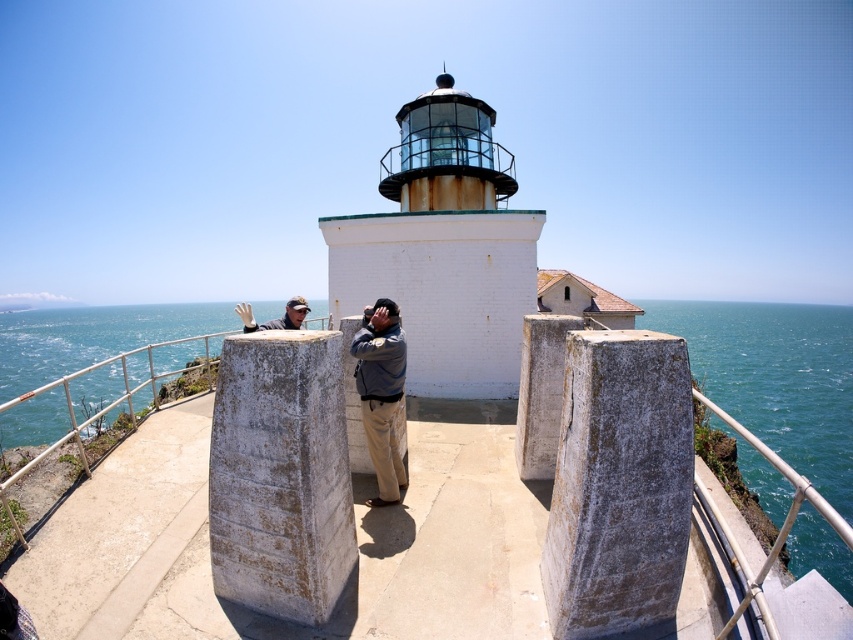
Does denim jacket at center have a greater width compared to matte gray jacket at center?

No, denim jacket at center is not wider than matte gray jacket at center.

Is point (395, 374) in front of point (253, 323)?

Yes, point (395, 374) is in front of point (253, 323).

Between point (384, 317) and point (253, 323), which one is positioned behind?

Point (253, 323)

This screenshot has width=853, height=640. Identify the location of denim jacket at center. (381, 394).

Is white brick lighthouse at center above blue water at lower right?

No, white brick lighthouse at center is not above blue water at lower right.

Which is more to the right, white brick lighthouse at center or blue water at lower right?

Positioned to the right is blue water at lower right.

In order to click on white brick lighthouse at center in this screenshot , I will do `click(444, 248)`.

This screenshot has width=853, height=640. I want to click on white brick lighthouse at center, so click(444, 248).

Between white brick lighthouse at center and denim jacket at center, which one appears on the right side from the viewer's perspective?

Positioned to the right is white brick lighthouse at center.

Does white brick lighthouse at center come behind denim jacket at center?

Yes, white brick lighthouse at center is further from the viewer.

Describe the element at coordinates (444, 248) in the screenshot. I see `white brick lighthouse at center` at that location.

This screenshot has width=853, height=640. Identify the location of white brick lighthouse at center. (444, 248).